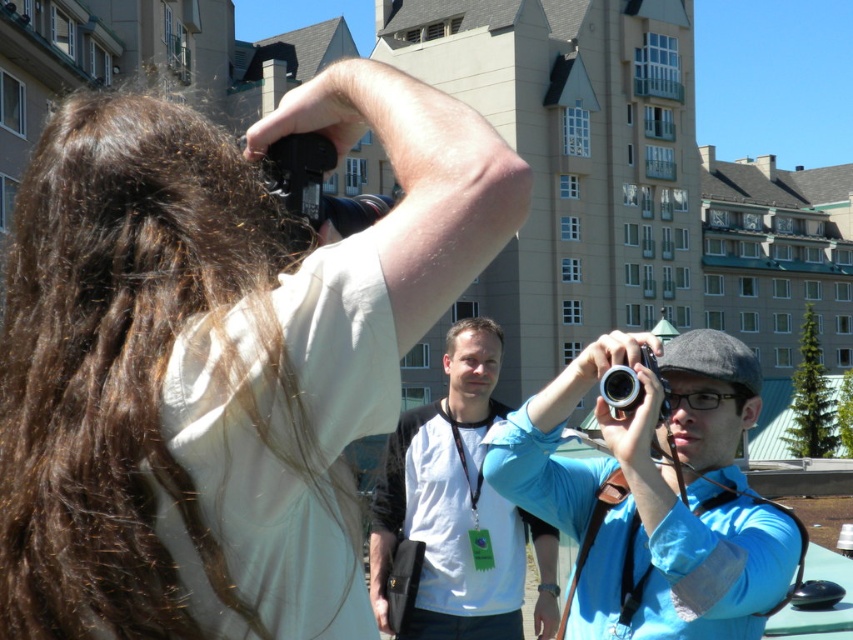
Which is below, black plastic camera at upper center or silver metallic camera at center?

Positioned lower is silver metallic camera at center.

Identify the location of black plastic camera at upper center. (316, 186).

Who is more forward, (355, 284) or (639, 346)?

Positioned in front is point (355, 284).

Who is higher up, matte white shirt at upper left or blue fabric shirt at center?

matte white shirt at upper left is higher up.

Find the location of a particular element. matte white shirt at upper left is located at coordinates (218, 356).

Which is below, white matte shirt at center or black plastic camera at upper center?

Positioned lower is white matte shirt at center.

Does white matte shirt at center appear on the left side of black plastic camera at upper center?

In fact, white matte shirt at center is to the right of black plastic camera at upper center.

Is point (431, 536) less distant than point (381, 195)?

Yes, point (431, 536) is closer to viewer.

The image size is (853, 640). I want to click on white matte shirt at center, so click(457, 509).